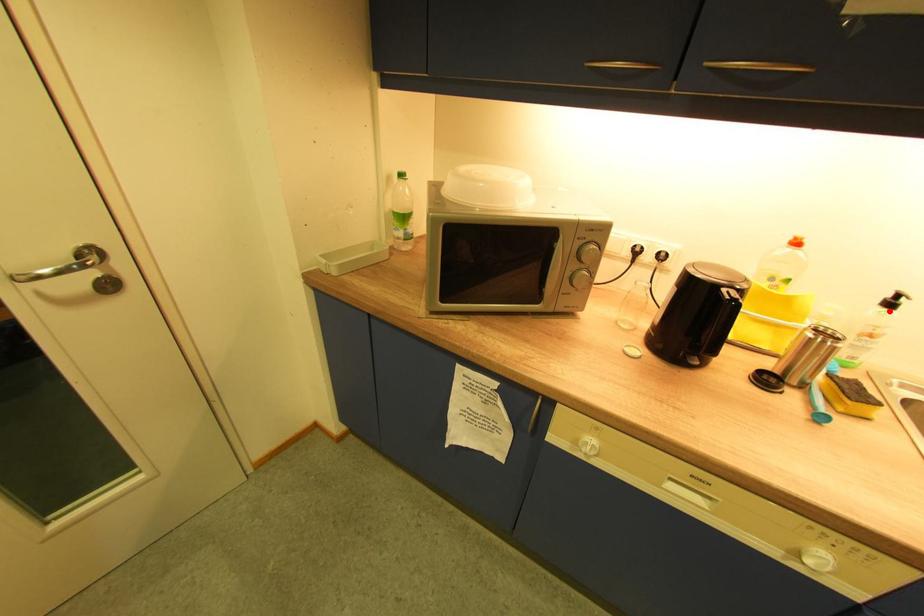
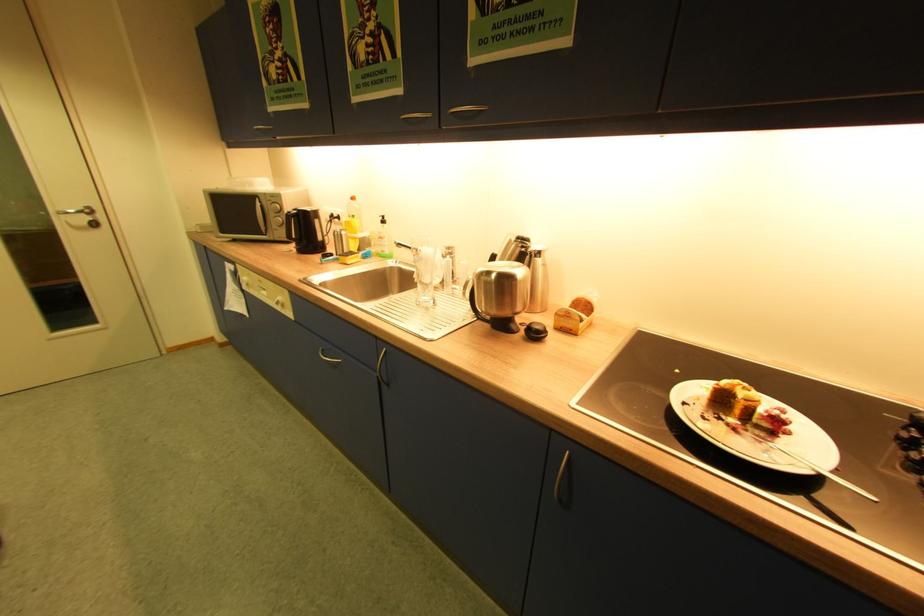
Where in the second image is the point corresponding to the highlighted location from the first image?

(386, 225)